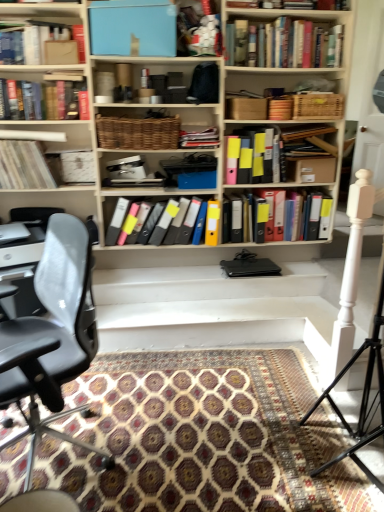
Question: Visually, is multicolored plastic folders at center, the 8th book positioned from the top, positioned to the left or to the right of black leather chair at left?

Choices:
 (A) right
 (B) left

Answer: (A)

Question: Do you think multicolored plastic folders at center, the 8th book positioned from the top, is within black leather chair at left, or outside of it?

Choices:
 (A) inside
 (B) outside

Answer: (B)

Question: Estimate the real-world distances between objects in this image. Which object is closer to the black plastic computer desk at left?

Choices:
 (A) matte cardboard box at upper left, which is the 6th book from bottom to top
 (B) white matte tripod at right
 (C) white matte stairs at center
 (D) blue glossy monitor at upper center, arranged as the 1th cabinet when viewed from the top
 (E) matte black folders at center, the fifth book positioned from the top

Answer: (C)

Question: Which is farther from the multicolored plastic folders at center, the 8th book positioned from the top?

Choices:
 (A) blue glossy monitor at upper center, arranged as the 1th cabinet when viewed from the top
 (B) white matte plastic container at upper center, acting as the second book starting from the top
 (C) matte black laptop at left
 (D) white matte tripod at right
 (E) woven brown basket at center, positioned as the 2th cabinet in top-to-bottom order

Answer: (D)